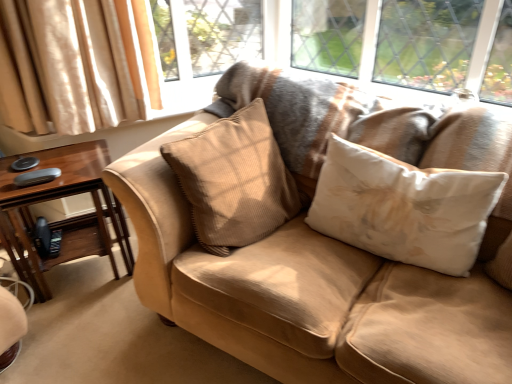
In order to face beige corduroy pillow at center, which appears as the 1th pillow when viewed from the left, should I rotate leftwards or rightwards?

Turn left approximately 2.295 degrees to face it.

The width and height of the screenshot is (512, 384). Describe the element at coordinates (234, 180) in the screenshot. I see `beige corduroy pillow at center, which appears as the 1th pillow when viewed from the left` at that location.

Measure the distance between suede couch at center and camera.

suede couch at center and camera are 38.44 inches apart.

Where is `white fabric pillow at center, acting as the 2th pillow starting from the left`? This screenshot has width=512, height=384. white fabric pillow at center, acting as the 2th pillow starting from the left is located at coordinates click(403, 207).

The width and height of the screenshot is (512, 384). Describe the element at coordinates (403, 207) in the screenshot. I see `white fabric pillow at center, which is the first pillow from right to left` at that location.

Image resolution: width=512 pixels, height=384 pixels. In order to click on beige corduroy pillow at center, which appears as the 1th pillow when viewed from the left in this screenshot , I will do `click(234, 180)`.

Considering the points (39, 156) and (437, 363), which point is in front, point (39, 156) or point (437, 363)?

The point (437, 363) is in front.

Does brown wood table at left have a lesser height compared to suede couch at center?

Yes.

From the image's perspective, is brown wood table at left below suede couch at center?

Indeed, from the image's perspective, brown wood table at left is shown beneath suede couch at center.

Consider the image. Would you say brown wood table at left is a long distance from suede couch at center?

They are positioned close to each other.

Based on their sizes in the image, would you say white fabric pillow at center, which is the first pillow from right to left, is bigger or smaller than suede couch at center?

In the image, white fabric pillow at center, which is the first pillow from right to left, appears to be smaller than suede couch at center.

Based on the photo, is white fabric pillow at center, acting as the 2th pillow starting from the left, taller than suede couch at center?

No, white fabric pillow at center, acting as the 2th pillow starting from the left, is not taller than suede couch at center.

From the image's perspective, which pillow is the 1st one above the suede couch at center? Please provide its 2D coordinates.

[(403, 207)]

From a real-world perspective, who is located higher, white fabric pillow at center, acting as the 2th pillow starting from the left, or suede couch at center?

white fabric pillow at center, acting as the 2th pillow starting from the left, is physically above.

Which of these two, white fabric pillow at center, which is the first pillow from right to left, or brown wood table at left, is bigger?

With larger size is brown wood table at left.

Is brown wood table at left at the back of white fabric pillow at center, acting as the 2th pillow starting from the left?

No.

From a real-world perspective, which object stands above the other?

white fabric pillow at center, which is the first pillow from right to left, is physically above.

Considering the sizes of white fabric pillow at center, which is the first pillow from right to left, and brown wood table at left in the image, is white fabric pillow at center, which is the first pillow from right to left, taller or shorter than brown wood table at left?

white fabric pillow at center, which is the first pillow from right to left, is shorter than brown wood table at left.

Could you measure the distance between beige corduroy pillow at center, which appears as the 1th pillow when viewed from the left, and suede couch at center?

beige corduroy pillow at center, which appears as the 1th pillow when viewed from the left, and suede couch at center are 6.67 inches apart.

Locate an element on the screen. pillow to the left of suede couch at center is located at coordinates (234, 180).

Is beige corduroy pillow at center, which appears as the 1th pillow when viewed from the left, not close to suede couch at center?

No, beige corduroy pillow at center, which appears as the 1th pillow when viewed from the left, is not far away from suede couch at center.

Is white fabric pillow at center, acting as the 2th pillow starting from the left, aimed at beige corduroy pillow at center, which is the second pillow in right-to-left order?

No, white fabric pillow at center, acting as the 2th pillow starting from the left, is not facing towards beige corduroy pillow at center, which is the second pillow in right-to-left order.

Which of these two, white fabric pillow at center, acting as the 2th pillow starting from the left, or beige corduroy pillow at center, which is the second pillow in right-to-left order, is wider?

beige corduroy pillow at center, which is the second pillow in right-to-left order.

Between white fabric pillow at center, acting as the 2th pillow starting from the left, and beige corduroy pillow at center, which is the second pillow in right-to-left order, which one has more height?

With more height is beige corduroy pillow at center, which is the second pillow in right-to-left order.

I want to click on the 1st pillow positioned above the suede couch at center (from a real-world perspective), so click(x=403, y=207).

Considering the sizes of objects suede couch at center and white fabric pillow at center, which is the first pillow from right to left, in the image provided, who is smaller, suede couch at center or white fabric pillow at center, which is the first pillow from right to left,?

white fabric pillow at center, which is the first pillow from right to left, is smaller.

Does suede couch at center have a lesser width compared to white fabric pillow at center, acting as the 2th pillow starting from the left?

In fact, suede couch at center might be wider than white fabric pillow at center, acting as the 2th pillow starting from the left.

Is point (320, 365) more distant than point (490, 182)?

No, it is in front of (490, 182).

In the scene shown: Can you confirm if beige corduroy pillow at center, which is the second pillow in right-to-left order, is wider than white fabric pillow at center, which is the first pillow from right to left?

Yes.

How much distance is there between beige corduroy pillow at center, which is the second pillow in right-to-left order, and white fabric pillow at center, acting as the 2th pillow starting from the left?

beige corduroy pillow at center, which is the second pillow in right-to-left order, is 13.57 inches away from white fabric pillow at center, acting as the 2th pillow starting from the left.

From a real-world perspective, is beige corduroy pillow at center, which is the second pillow in right-to-left order, located higher than white fabric pillow at center, acting as the 2th pillow starting from the left?

Indeed, from a real-world perspective, beige corduroy pillow at center, which is the second pillow in right-to-left order, stands above white fabric pillow at center, acting as the 2th pillow starting from the left.

Is beige corduroy pillow at center, which is the second pillow in right-to-left order, far from white fabric pillow at center, acting as the 2th pillow starting from the left?

No, there isn't a large distance between beige corduroy pillow at center, which is the second pillow in right-to-left order, and white fabric pillow at center, acting as the 2th pillow starting from the left.

Image resolution: width=512 pixels, height=384 pixels. I want to click on studio couch to the right of brown wood table at left, so click(x=318, y=236).

The width and height of the screenshot is (512, 384). What are the coordinates of `studio couch that is in front of the white fabric pillow at center, acting as the 2th pillow starting from the left` in the screenshot? It's located at (318, 236).

Consider the image. Looking at the image, which one is located closer to suede couch at center, white fabric pillow at center, acting as the 2th pillow starting from the left, or beige corduroy pillow at center, which is the second pillow in right-to-left order?

The object closer to suede couch at center is beige corduroy pillow at center, which is the second pillow in right-to-left order.

Based on their spatial positions, is brown wood table at left or beige corduroy pillow at center, which is the second pillow in right-to-left order, further from white fabric pillow at center, which is the first pillow from right to left?

Based on the image, brown wood table at left appears to be further to white fabric pillow at center, which is the first pillow from right to left.

From the image, which object appears to be farther from suede couch at center, brown wood table at left or beige corduroy pillow at center, which is the second pillow in right-to-left order?

brown wood table at left is further to suede couch at center.

Considering their positions, is suede couch at center positioned closer to beige corduroy pillow at center, which appears as the 1th pillow when viewed from the left, than brown wood table at left?

suede couch at center lies closer to beige corduroy pillow at center, which appears as the 1th pillow when viewed from the left, than the other object.

Considering their positions, is beige corduroy pillow at center, which appears as the 1th pillow when viewed from the left, positioned further to brown wood table at left than suede couch at center?

suede couch at center.

From the image, which object appears to be farther from white fabric pillow at center, acting as the 2th pillow starting from the left, beige corduroy pillow at center, which appears as the 1th pillow when viewed from the left, or suede couch at center?

The object further to white fabric pillow at center, acting as the 2th pillow starting from the left, is beige corduroy pillow at center, which appears as the 1th pillow when viewed from the left.

Considering their positions, is white fabric pillow at center, acting as the 2th pillow starting from the left, positioned closer to brown wood table at left than beige corduroy pillow at center, which is the second pillow in right-to-left order?

beige corduroy pillow at center, which is the second pillow in right-to-left order, lies closer to brown wood table at left than the other object.

Considering their positions, is suede couch at center positioned further to beige corduroy pillow at center, which is the second pillow in right-to-left order, than white fabric pillow at center, which is the first pillow from right to left?

The object further to beige corduroy pillow at center, which is the second pillow in right-to-left order, is white fabric pillow at center, which is the first pillow from right to left.

Find the location of a particular element. The image size is (512, 384). pillow between brown wood table at left and white fabric pillow at center, acting as the 2th pillow starting from the left, in the horizontal direction is located at coordinates (234, 180).

The width and height of the screenshot is (512, 384). I want to click on pillow situated between brown wood table at left and suede couch at center from left to right, so point(234,180).

The height and width of the screenshot is (384, 512). Identify the location of studio couch between brown wood table at left and white fabric pillow at center, acting as the 2th pillow starting from the left, from left to right. (318, 236).

Find the location of `pillow between suede couch at center and beige corduroy pillow at center, which is the second pillow in right-to-left order, from front to back`. pillow between suede couch at center and beige corduroy pillow at center, which is the second pillow in right-to-left order, from front to back is located at coordinates (403, 207).